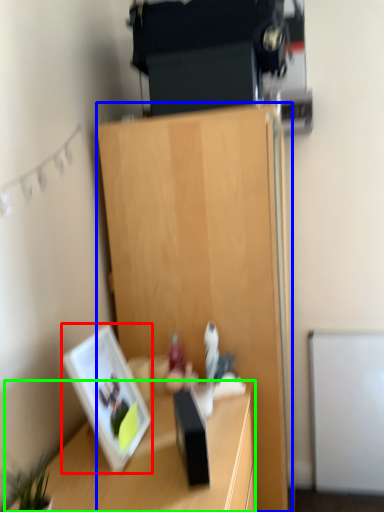
Question: Which is nearer to the picture frame (highlighted by a red box)? cabinetry (highlighted by a blue box) or desk (highlighted by a green box).

Choices:
 (A) cabinetry
 (B) desk

Answer: (B)